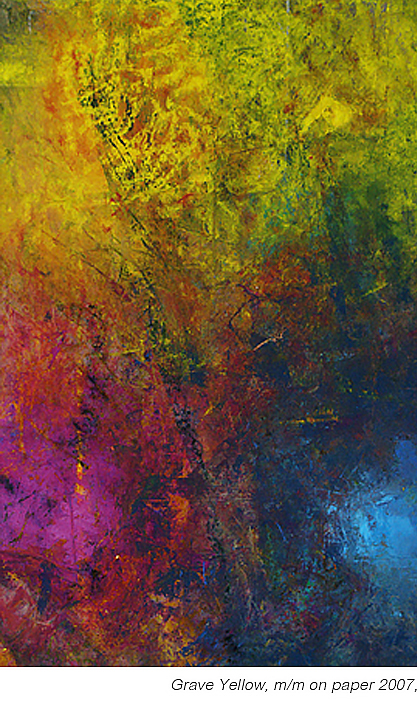
Where is `solid blue part of painting`? The height and width of the screenshot is (708, 417). solid blue part of painting is located at coordinates (394, 531).